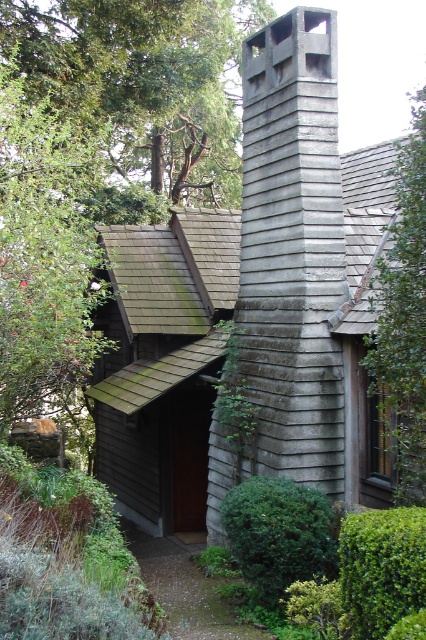
Question: Does wooden cabin at center have a larger size compared to green leafy tree at upper left?

Choices:
 (A) no
 (B) yes

Answer: (A)

Question: Among these points, which one is farthest from the camera?

Choices:
 (A) coord(244,355)
 (B) coord(412,337)
 (C) coord(169,116)

Answer: (C)

Question: Can you confirm if gray wood chimney at center is positioned below green leafy tree at upper left?

Choices:
 (A) no
 (B) yes

Answer: (B)

Question: Which object is closer to the camera taking this photo?

Choices:
 (A) green leafy tree at upper left
 (B) wooden cabin at center
 (C) gray wood chimney at center

Answer: (B)

Question: Does wooden cabin at center appear on the right side of green leafy tree at right?

Choices:
 (A) yes
 (B) no

Answer: (B)

Question: Among these points, which one is farthest from the camera?

Choices:
 (A) (28, 10)
 (B) (294, 355)
 (C) (216, 369)

Answer: (A)